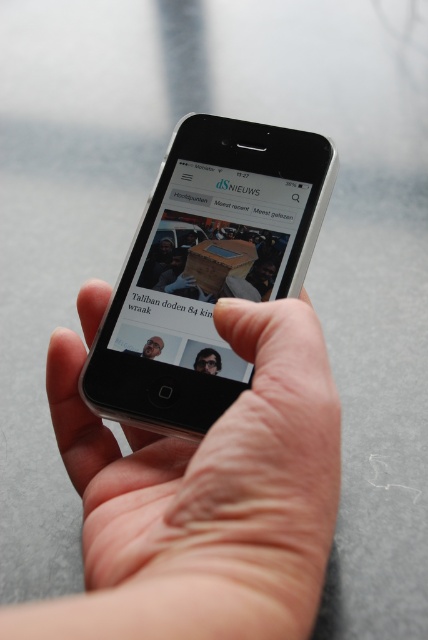
Question: Which point appears closest to the camera in this image?

Choices:
 (A) (184, 131)
 (B) (100, 529)
 (C) (204, 353)

Answer: (B)

Question: Is skinny white hand at center positioned in front of silver metallic smartphone at center?

Choices:
 (A) yes
 (B) no

Answer: (A)

Question: Is skinny white hand at center further to camera compared to silver metallic smartphone at center?

Choices:
 (A) no
 (B) yes

Answer: (A)

Question: Considering the real-world distances, which object is closest to the skinny white hand at center?

Choices:
 (A) silver metallic smartphone at center
 (B) matte black glasses at center

Answer: (A)

Question: Can you confirm if skinny white hand at center is positioned to the right of silver metallic smartphone at center?

Choices:
 (A) no
 (B) yes

Answer: (B)

Question: Which point is closer to the camera taking this photo?

Choices:
 (A) (225, 429)
 (B) (199, 355)
 (C) (240, 211)

Answer: (A)